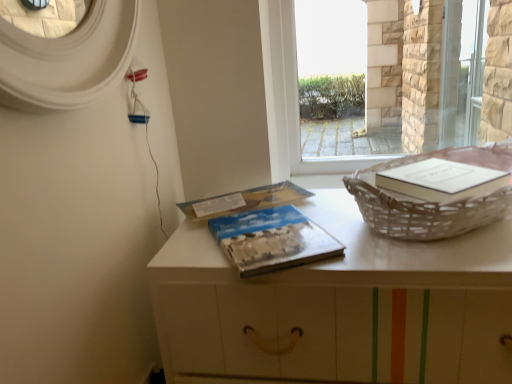
Question: Considering the positions of blue textured paper at center, marked as the 1th paperback book in a front-to-back arrangement, and woven wicker basket at right in the image, is blue textured paper at center, marked as the 1th paperback book in a front-to-back arrangement, taller or shorter than woven wicker basket at right?

Choices:
 (A) tall
 (B) short

Answer: (B)

Question: From a real-world perspective, is blue textured paper at center, marked as the second paperback book in a back-to-front arrangement, positioned above or below woven wicker basket at right?

Choices:
 (A) below
 (B) above

Answer: (A)

Question: Considering the real-world distances, which object is closest to the white matte table at center?

Choices:
 (A) blue matte paper at center, the 1th paperback book when ordered from back to front
 (B) woven wicker basket at right
 (C) blue textured paper at center, marked as the 1th paperback book in a front-to-back arrangement
 (D) transparent glass window at center
 (E) transparent glass screen door at upper right

Answer: (C)

Question: Which object is positioned closest to the white matte table at center?

Choices:
 (A) transparent glass window at center
 (B) transparent glass screen door at upper right
 (C) blue textured paper at center, marked as the second paperback book in a back-to-front arrangement
 (D) blue matte paper at center, which appears as the second paperback book when viewed from the front
 (E) woven wicker basket at right

Answer: (C)